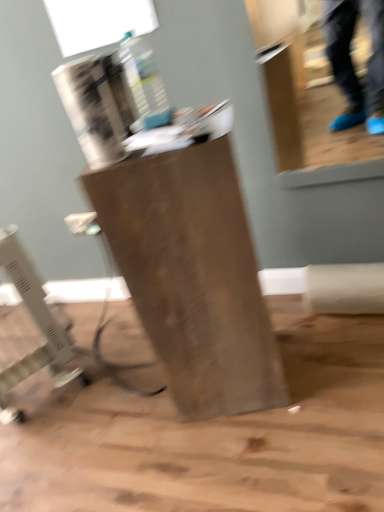
Find the location of `vacant area that is in front of matte brown cabinet at center`. vacant area that is in front of matte brown cabinet at center is located at coordinates (260, 454).